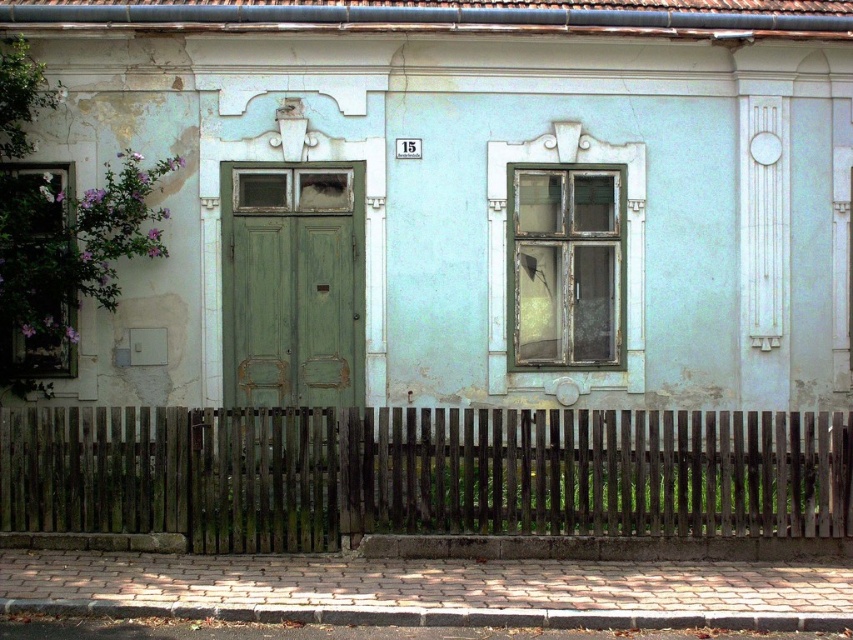
Does weathered wood fence at lower center have a greater height compared to green matte door at center?

No.

Which of these two, weathered wood fence at lower center or green matte door at center, stands shorter?

weathered wood fence at lower center is shorter.

Who is more distant from viewer, (701, 524) or (300, 205)?

Positioned behind is point (300, 205).

Image resolution: width=853 pixels, height=640 pixels. I want to click on weathered wood fence at lower center, so [x=421, y=472].